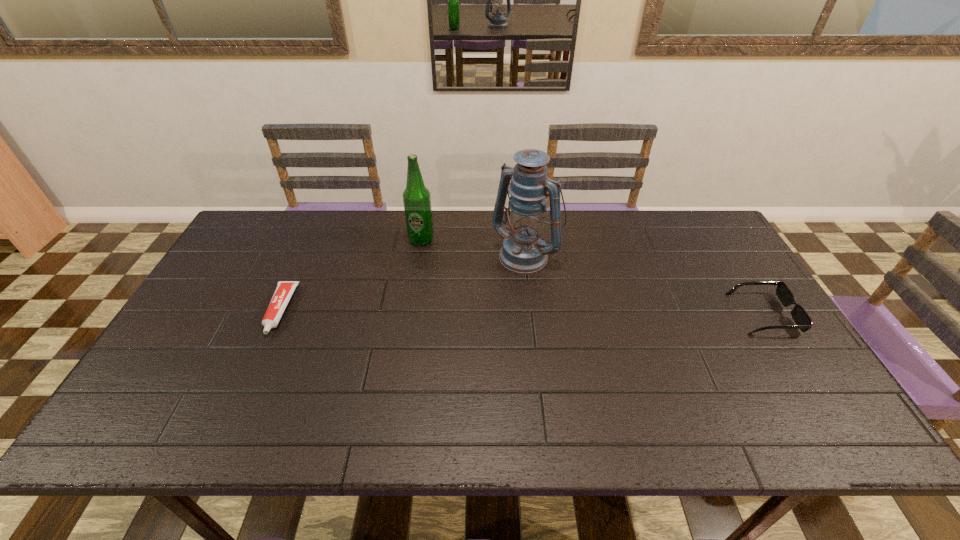
Identify the location of toothpaste. The width and height of the screenshot is (960, 540). [284, 290].

At what (x,y) coordinates should I click in order to perform the action: click on the shortest object. Please return your answer as a coordinate pair (x, y). This screenshot has width=960, height=540. Looking at the image, I should click on (284, 290).

Locate an element on the screen. The image size is (960, 540). the second shortest object is located at coordinates (803, 321).

This screenshot has width=960, height=540. In order to click on sunglasses in this screenshot , I will do `click(803, 321)`.

Find the location of a particular element. This screenshot has height=540, width=960. the tallest object is located at coordinates (524, 250).

Where is `lantern`? The image size is (960, 540). lantern is located at coordinates (524, 250).

The width and height of the screenshot is (960, 540). What are the coordinates of `the second object from left to right` in the screenshot? It's located at (416, 197).

Where is `beer bottle`? beer bottle is located at coordinates (416, 197).

Where is `free space located at the nozzle of the shortest object`? The height and width of the screenshot is (540, 960). free space located at the nozzle of the shortest object is located at coordinates (256, 362).

At what (x,y) coordinates should I click in order to perform the action: click on vacant area located on the front-facing side of the lantern. Please return your answer as a coordinate pair (x, y). Looking at the image, I should click on pos(493,287).